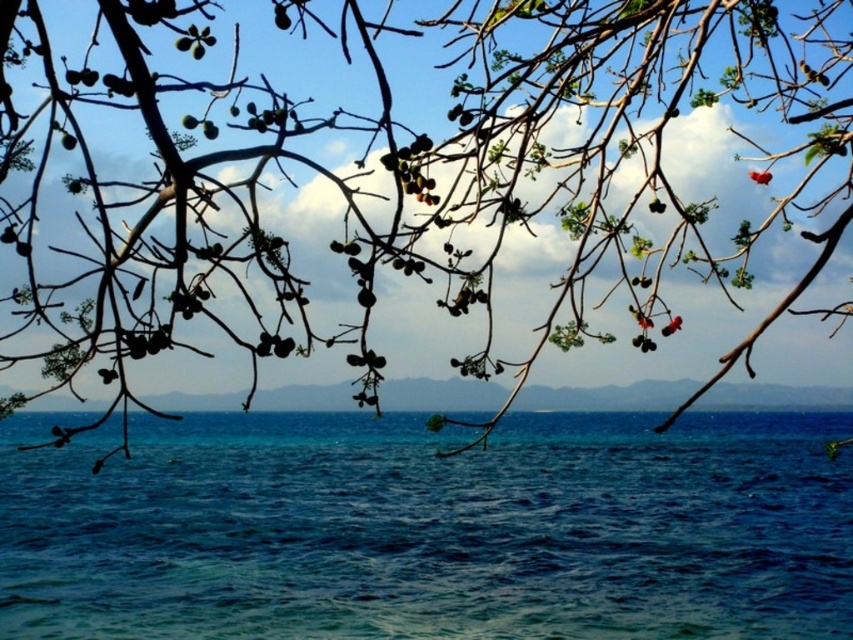
You are standing in a coastal area and see the green matte leaves at upper center and the blue matte horizon at center. Which object is closer to you?

The green matte leaves at upper center are closer to you as they are positioned in front of the blue matte horizon at center.

You are standing on a cliff overlooking the ocean. You see the blue liquid water at lower center and the blue matte horizon at center. Which one is closer to your current position?

The blue liquid water at lower center is closer to your current position because it is located below the blue matte horizon at center, indicating it is nearer in the visual perspective.